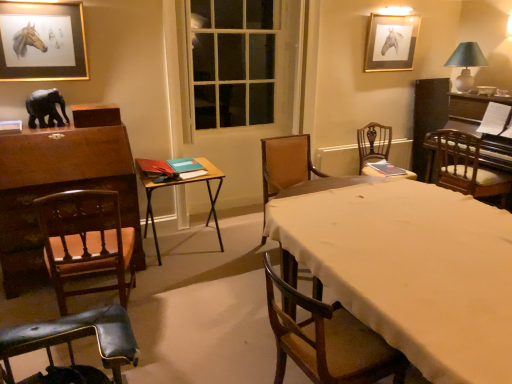
Identify the location of blank space situated above gold-framed picture at upper right, the first picture frame positioned from the right (from a real-world perspective). The height and width of the screenshot is (384, 512). (395, 15).